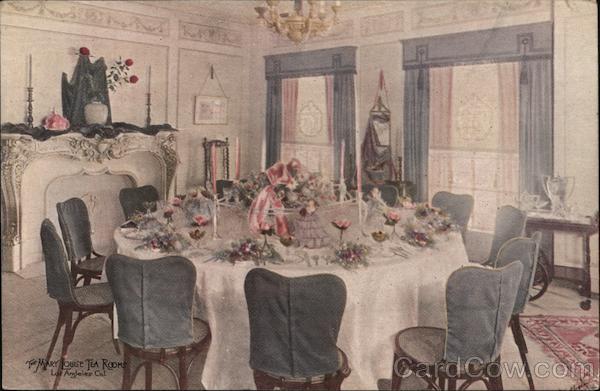
Find the location of a particular element. This screenshot has width=600, height=391. mantle is located at coordinates (117, 137).